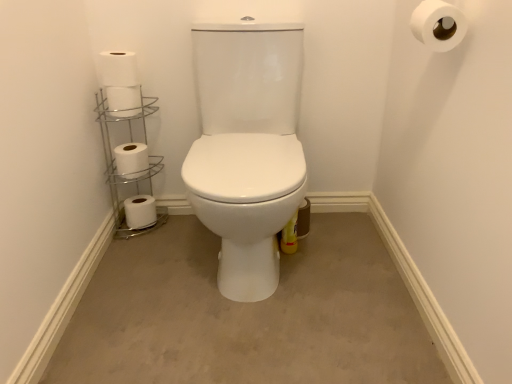
Question: Is there a large distance between white matte toilet paper at lower left, placed as the 5th toilet paper when sorted from top to bottom, and white matte toilet paper at upper right, acting as the 5th toilet paper starting from the back?

Choices:
 (A) yes
 (B) no

Answer: (A)

Question: Does white matte toilet paper at lower left, the fifth toilet paper when ordered from right to left, have a lesser width compared to white matte toilet paper at upper right, the first toilet paper in the right-to-left sequence?

Choices:
 (A) no
 (B) yes

Answer: (B)

Question: From the image's perspective, is white matte toilet paper at lower left, the 1th toilet paper viewed from the left, located above white matte toilet paper at upper right, acting as the 5th toilet paper starting from the back?

Choices:
 (A) yes
 (B) no

Answer: (B)

Question: From a real-world perspective, is white matte toilet paper at lower left, the 1th toilet paper viewed from the left, positioned under white matte toilet paper at upper right, the second toilet paper when ordered from top to bottom, based on gravity?

Choices:
 (A) no
 (B) yes

Answer: (B)

Question: Is white matte toilet paper at lower left, the 5th toilet paper positioned from the front, closer to the viewer compared to white matte toilet paper at upper right, marked as the first toilet paper in a front-to-back arrangement?

Choices:
 (A) no
 (B) yes

Answer: (A)

Question: Looking at their shapes, would you say silver/metallic toilet paper holder at left is wider or thinner than beige carpet at center?

Choices:
 (A) wide
 (B) thin

Answer: (B)

Question: From a real-world perspective, is silver/metallic toilet paper holder at left positioned above or below beige carpet at center?

Choices:
 (A) above
 (B) below

Answer: (A)

Question: Based on their sizes in the image, would you say silver/metallic toilet paper holder at left is bigger or smaller than beige carpet at center?

Choices:
 (A) small
 (B) big

Answer: (A)

Question: In the image, is silver/metallic toilet paper holder at left on the left side or the right side of beige carpet at center?

Choices:
 (A) left
 (B) right

Answer: (A)

Question: Considering the positions of white matte toilet paper at left, the third toilet paper from the bottom, and silver/metallic toilet paper holder at left in the image, is white matte toilet paper at left, the third toilet paper from the bottom, taller or shorter than silver/metallic toilet paper holder at left?

Choices:
 (A) tall
 (B) short

Answer: (B)

Question: Is white matte toilet paper at left, the third toilet paper from the bottom, to the left or to the right of silver/metallic toilet paper holder at left in the image?

Choices:
 (A) right
 (B) left

Answer: (A)

Question: Is white matte toilet paper at left, the third toilet paper from the right, inside or outside of silver/metallic toilet paper holder at left?

Choices:
 (A) inside
 (B) outside

Answer: (B)

Question: From a real-world perspective, is white matte toilet paper at left, the third toilet paper in the left-to-right sequence, positioned above or below silver/metallic toilet paper holder at left?

Choices:
 (A) above
 (B) below

Answer: (A)

Question: Based on their sizes in the image, would you say beige carpet at center is bigger or smaller than white matte toilet paper at upper left, which is the second toilet paper from front to back?

Choices:
 (A) big
 (B) small

Answer: (A)

Question: From a real-world perspective, is beige carpet at center physically located above or below white matte toilet paper at upper left, the 2th toilet paper in the right-to-left sequence?

Choices:
 (A) above
 (B) below

Answer: (B)